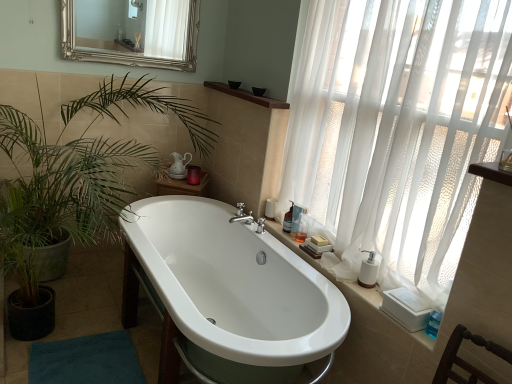
Question: Is translucent plastic bottle at right, which ranks as the first toiletry in back-to-front order, closer to camera compared to green leafy plant at left?

Choices:
 (A) no
 (B) yes

Answer: (A)

Question: Does translucent plastic bottle at right, which appears as the 3th toiletry when viewed from the front, appear on the right side of green leafy plant at left?

Choices:
 (A) no
 (B) yes

Answer: (B)

Question: Is translucent plastic bottle at right, which appears as the 3th toiletry when viewed from the front, facing towards green leafy plant at left?

Choices:
 (A) no
 (B) yes

Answer: (A)

Question: From a real-world perspective, is translucent plastic bottle at right, which appears as the 3th toiletry when viewed from the front, located beneath green leafy plant at left?

Choices:
 (A) no
 (B) yes

Answer: (A)

Question: From a real-world perspective, is translucent plastic bottle at right, which ranks as the first toiletry in back-to-front order, over green leafy plant at left?

Choices:
 (A) yes
 (B) no

Answer: (A)

Question: From the image's perspective, relative to white sheer curtain at right, is translucent plastic bottle at right, which ranks as the first toiletry in back-to-front order, above or below?

Choices:
 (A) below
 (B) above

Answer: (A)

Question: In the image, is translucent plastic bottle at right, which appears as the 3th toiletry when viewed from the front, positioned in front of or behind white sheer curtain at right?

Choices:
 (A) front
 (B) behind

Answer: (B)

Question: Is translucent plastic bottle at right, which appears as the 3th toiletry when viewed from the front, wider or thinner than white sheer curtain at right?

Choices:
 (A) wide
 (B) thin

Answer: (B)

Question: Is translucent plastic bottle at right, which ranks as the first toiletry in back-to-front order, taller or shorter than white sheer curtain at right?

Choices:
 (A) tall
 (B) short

Answer: (B)

Question: From their relative heights in the image, would you say green leafy plant at left is taller or shorter than white glossy bathtub at center?

Choices:
 (A) short
 (B) tall

Answer: (B)

Question: From a real-world perspective, is green leafy plant at left positioned above or below white glossy bathtub at center?

Choices:
 (A) below
 (B) above

Answer: (B)

Question: In terms of width, does green leafy plant at left look wider or thinner when compared to white glossy bathtub at center?

Choices:
 (A) wide
 (B) thin

Answer: (A)

Question: Looking at the image, does green leafy plant at left seem bigger or smaller compared to white glossy bathtub at center?

Choices:
 (A) small
 (B) big

Answer: (B)

Question: From the image's perspective, is white glossy bathtub at center above or below white sheer curtain at right?

Choices:
 (A) below
 (B) above

Answer: (A)

Question: Looking at the image, does white glossy bathtub at center seem bigger or smaller compared to white sheer curtain at right?

Choices:
 (A) big
 (B) small

Answer: (A)